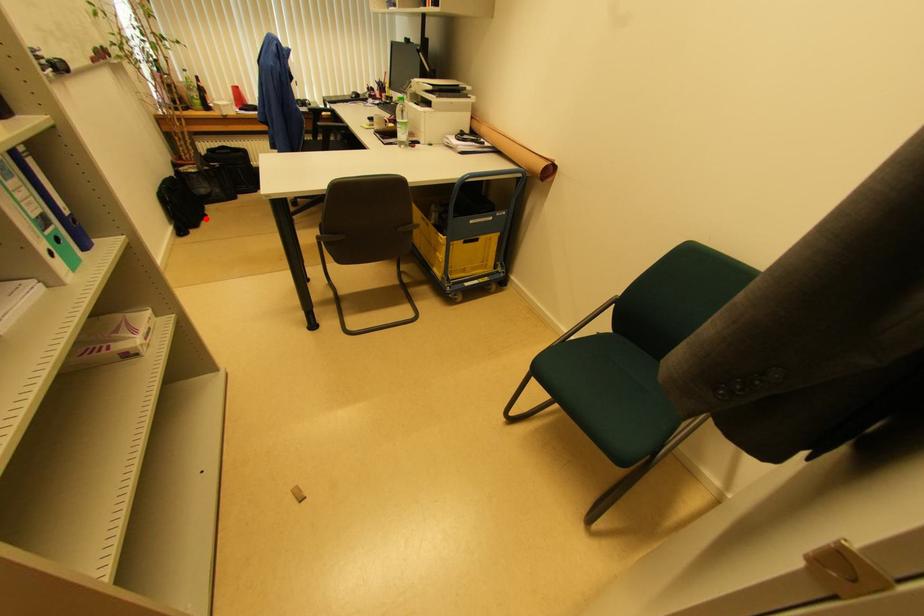
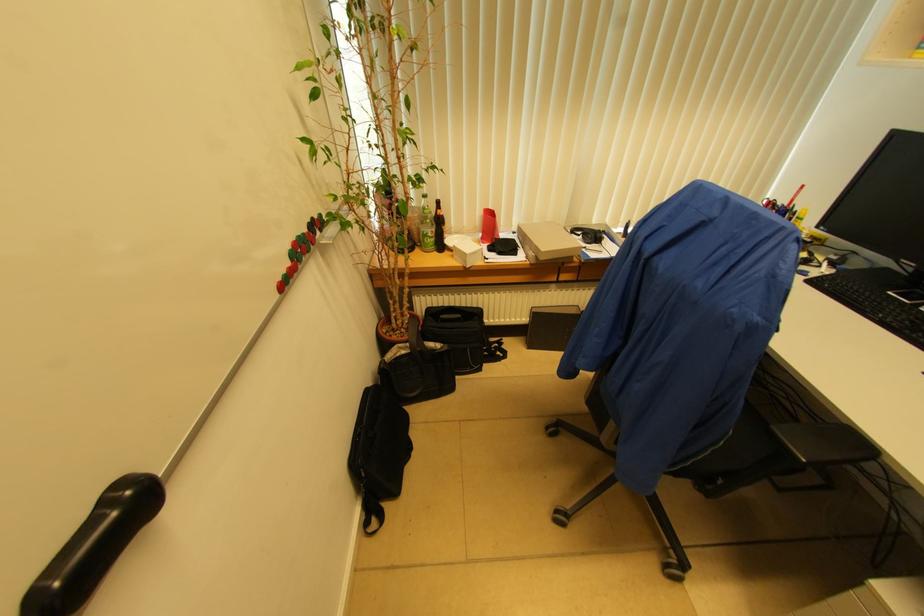
Question: A red point is marked in image1. In image2, is the corresponding 3D point closer to the camera or farther? Reply with the corresponding letter.

Choices:
 (A) The corresponding 3D point is closer.
 (B) The corresponding 3D point is farther.

Answer: (B)